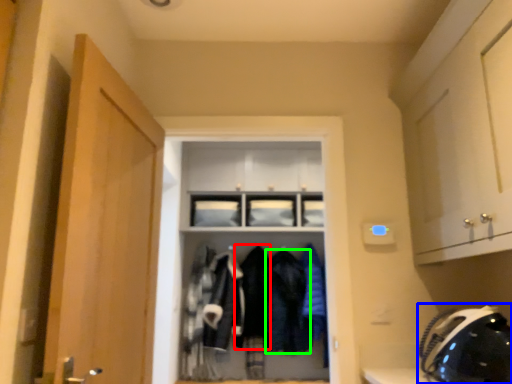
Question: Considering the real-world distances, which object is farthest from clothing (highlighted by a red box)? helmet (highlighted by a blue box) or clothing (highlighted by a green box)?

Choices:
 (A) helmet
 (B) clothing

Answer: (A)